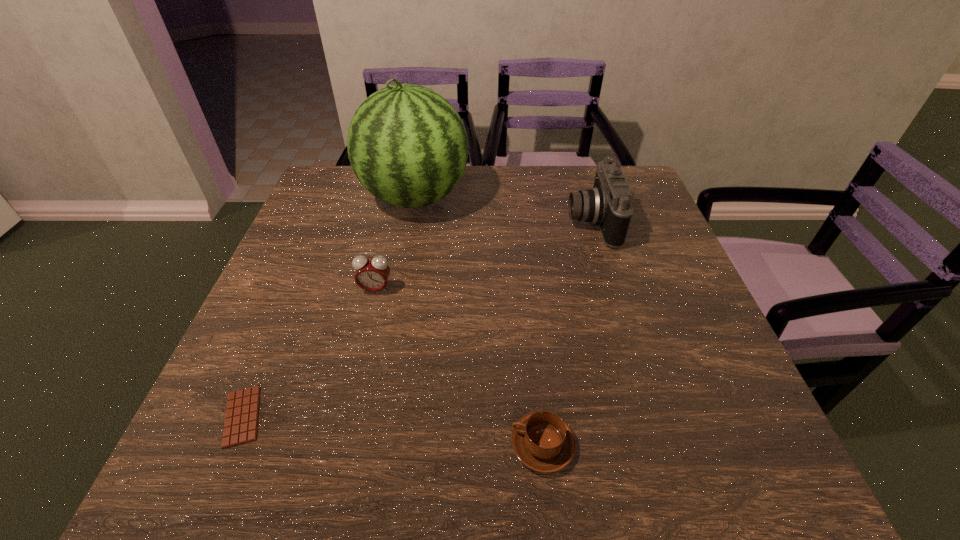
Find the location of `vacant area that lies between the rightmost object and the third farthest object`. vacant area that lies between the rightmost object and the third farthest object is located at coordinates (484, 255).

Find the location of a particular element. This screenshot has width=960, height=540. vacant area between the watermelon and the candy bar is located at coordinates (328, 307).

You are a GUI agent. You are given a task and a screenshot of the screen. Output one action in this format:
    pyautogui.click(x=<x>, y=<y>)
    Task: Click on the blank region between the alarm clock and the shortest object
    The image size is (960, 540).
    Given the screenshot: What is the action you would take?
    coord(309,353)

Identify the location of blank region between the shortest object and the second object from right to left. Image resolution: width=960 pixels, height=540 pixels. (393, 431).

The image size is (960, 540). In order to click on free space between the leftmost object and the watermelon in this screenshot , I will do [328, 307].

Select which object appears as the third closest to the shortest object. Please provide its 2D coordinates. Your answer should be formatted as a tuple, i.e. [(x, y)], where the tuple contains the x and y coordinates of a point satisfying the conditions above.

[(407, 145)]

Locate which object ranks fourth in proximity to the leftmost object. Please provide its 2D coordinates. Your answer should be formatted as a tuple, i.e. [(x, y)], where the tuple contains the x and y coordinates of a point satisfying the conditions above.

[(608, 205)]

Where is `free location that satisfies the following two spatial constraints: 1. on the front-facing side of the rightmost object; 2. on the clock face of the third farthest object`? free location that satisfies the following two spatial constraints: 1. on the front-facing side of the rightmost object; 2. on the clock face of the third farthest object is located at coordinates (612, 289).

What are the coordinates of `free spot that satisfies the following two spatial constraints: 1. on the front-facing side of the fourth shortest object; 2. on the clock face of the third farthest object` in the screenshot? It's located at (612, 289).

Identify the location of free location that satisfies the following two spatial constraints: 1. on the front-facing side of the rightmost object; 2. on the clock face of the third nearest object. The width and height of the screenshot is (960, 540). (612, 289).